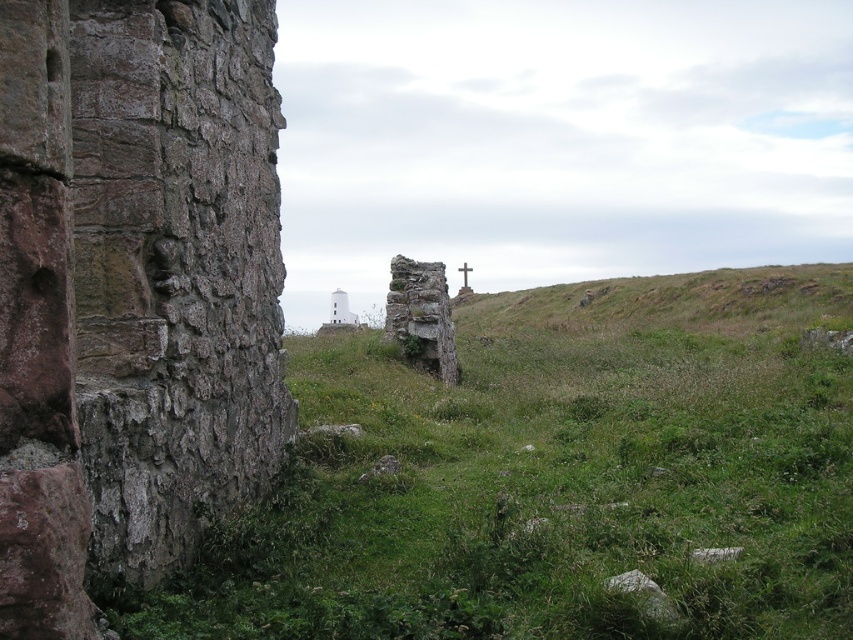
Is point (482, 611) farther from viewer compared to point (466, 268)?

No, it is not.

Is point (489, 294) farther from camera compared to point (465, 285)?

No, it is in front of (465, 285).

The width and height of the screenshot is (853, 640). In order to click on green grassy at center in this screenshot , I will do `click(556, 474)`.

The width and height of the screenshot is (853, 640). I want to click on green grassy hillside at center, so click(670, 298).

Is green grassy hillside at center shorter than white wooden cross at center?

No, green grassy hillside at center is not shorter than white wooden cross at center.

Where is `green grassy hillside at center`? This screenshot has height=640, width=853. green grassy hillside at center is located at coordinates 670,298.

Who is positioned more to the left, green grassy hillside at center or white smooth tower at center?

white smooth tower at center

This screenshot has width=853, height=640. Find the location of `green grassy hillside at center`. green grassy hillside at center is located at coordinates (670, 298).

Where is `green grassy hillside at center`? green grassy hillside at center is located at coordinates (670, 298).